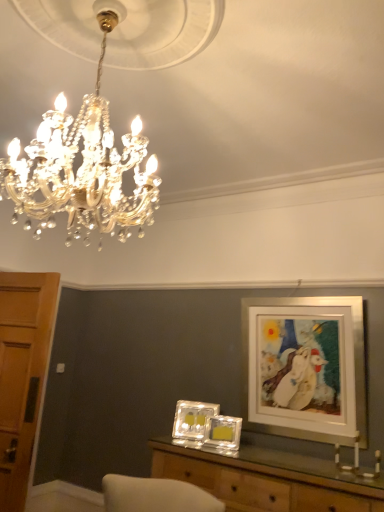
Identify the location of vacant space to the right of translucent glass picture frame at center, which appears as the 2th picture frame when viewed from the right. The image size is (384, 512). (248, 452).